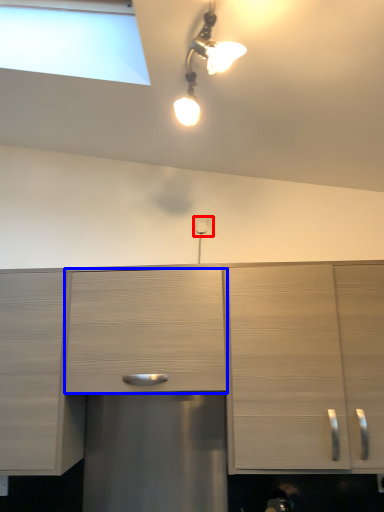
Question: Which of the following is the closest to the observer, electric outlet (highlighted by a red box) or drawer (highlighted by a blue box)?

Choices:
 (A) electric outlet
 (B) drawer

Answer: (B)